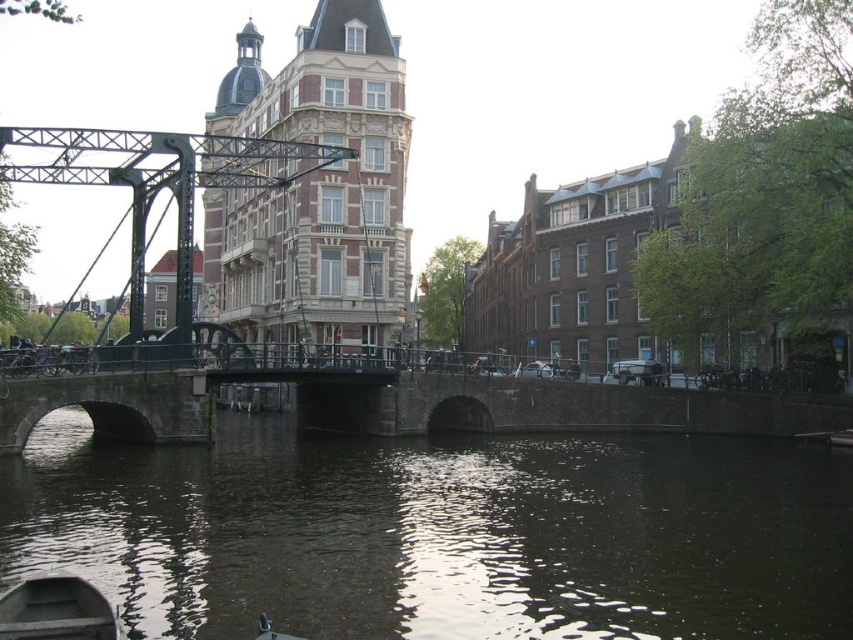
Question: Can you confirm if dark green water at center is smaller than wooden boat at lower left?

Choices:
 (A) no
 (B) yes

Answer: (A)

Question: Which object is closer to the camera taking this photo?

Choices:
 (A) dark green water at center
 (B) matte black bridge at center

Answer: (A)

Question: Is dark green water at center further to camera compared to wooden boat at lower left?

Choices:
 (A) yes
 (B) no

Answer: (A)

Question: Considering the real-world distances, which object is closest to the matte black bridge at center?

Choices:
 (A) wooden boat at lower left
 (B) dark green water at center

Answer: (B)

Question: Estimate the real-world distances between objects in this image. Which object is farther from the dark green water at center?

Choices:
 (A) wooden boat at lower left
 (B) matte black bridge at center

Answer: (A)

Question: Is dark green water at center above matte black bridge at center?

Choices:
 (A) no
 (B) yes

Answer: (A)